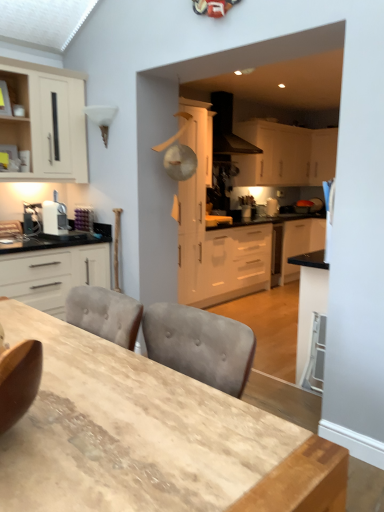
Question: Could you tell me if black matte range hood at upper center is facing wooden table at center?

Choices:
 (A) yes
 (B) no

Answer: (B)

Question: Is black matte range hood at upper center taller than wooden table at center?

Choices:
 (A) no
 (B) yes

Answer: (A)

Question: From a real-world perspective, does black matte range hood at upper center sit lower than wooden table at center?

Choices:
 (A) yes
 (B) no

Answer: (B)

Question: Is black matte range hood at upper center next to wooden table at center?

Choices:
 (A) no
 (B) yes

Answer: (A)

Question: Considering the relative positions of black matte range hood at upper center and wooden table at center in the image provided, is black matte range hood at upper center to the right of wooden table at center from the viewer's perspective?

Choices:
 (A) yes
 (B) no

Answer: (A)

Question: Is matte white cabinet at upper left, which is counted as the fifth cabinetry, starting from the right, situated inside white matte cabinet at center, acting as the third cabinetry starting from the back, or outside?

Choices:
 (A) outside
 (B) inside

Answer: (A)

Question: Looking at the image, does matte white cabinet at upper left, which is the 1th cabinetry from left to right, seem bigger or smaller compared to white matte cabinet at center, acting as the third cabinetry starting from the back?

Choices:
 (A) big
 (B) small

Answer: (B)

Question: Is matte white cabinet at upper left, which is the 1th cabinetry from left to right, in front of or behind white matte cabinet at center, arranged as the third cabinetry when viewed from the right, in the image?

Choices:
 (A) behind
 (B) front

Answer: (B)

Question: From the image's perspective, is matte white cabinet at upper left, positioned as the fourth cabinetry in back-to-front order, located above or below white matte cabinet at center, acting as the third cabinetry starting from the back?

Choices:
 (A) above
 (B) below

Answer: (A)

Question: Relative to black matte range hood at upper center, is white matte cabinet at left, arranged as the first cabinetry when viewed from the front, in front or behind?

Choices:
 (A) behind
 (B) front

Answer: (B)

Question: From the image's perspective, relative to black matte range hood at upper center, is white matte cabinet at left, which is the 4th cabinetry from right to left, above or below?

Choices:
 (A) above
 (B) below

Answer: (B)

Question: From their relative heights in the image, would you say white matte cabinet at left, which is the 4th cabinetry from right to left, is taller or shorter than black matte range hood at upper center?

Choices:
 (A) short
 (B) tall

Answer: (B)

Question: From a real-world perspective, is white matte cabinet at left, which is the 4th cabinetry from right to left, above or below black matte range hood at upper center?

Choices:
 (A) above
 (B) below

Answer: (B)

Question: In terms of size, does white matte cabinet at upper center, placed as the 2th cabinetry when sorted from back to front, appear bigger or smaller than wooden table at center?

Choices:
 (A) small
 (B) big

Answer: (A)

Question: In terms of height, does white matte cabinet at upper center, marked as the 2th cabinetry in a right-to-left arrangement, look taller or shorter compared to wooden table at center?

Choices:
 (A) short
 (B) tall

Answer: (B)